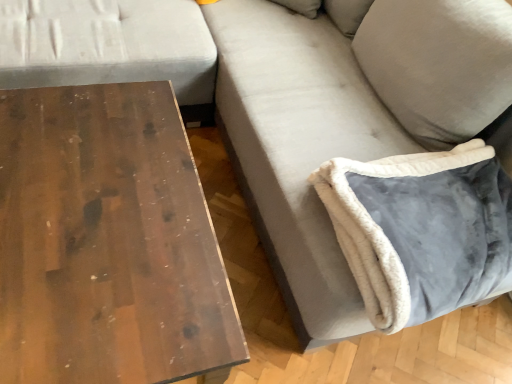
Question: From a real-world perspective, is velvet gray pillow at lower right positioned above or below wooden table at left?

Choices:
 (A) below
 (B) above

Answer: (B)

Question: Is velvet gray pillow at lower right taller or shorter than wooden table at left?

Choices:
 (A) short
 (B) tall

Answer: (A)

Question: In terms of size, does velvet gray pillow at lower right appear bigger or smaller than wooden table at left?

Choices:
 (A) big
 (B) small

Answer: (B)

Question: Does point (175, 193) appear closer or farther from the camera than point (431, 165)?

Choices:
 (A) farther
 (B) closer

Answer: (B)

Question: From a real-world perspective, is wooden table at left positioned above or below velvet gray pillow at lower right?

Choices:
 (A) above
 (B) below

Answer: (B)

Question: In terms of width, does wooden table at left look wider or thinner when compared to velvet gray pillow at lower right?

Choices:
 (A) thin
 (B) wide

Answer: (B)

Question: Do you think wooden table at left is within velvet gray pillow at lower right, or outside of it?

Choices:
 (A) inside
 (B) outside

Answer: (B)